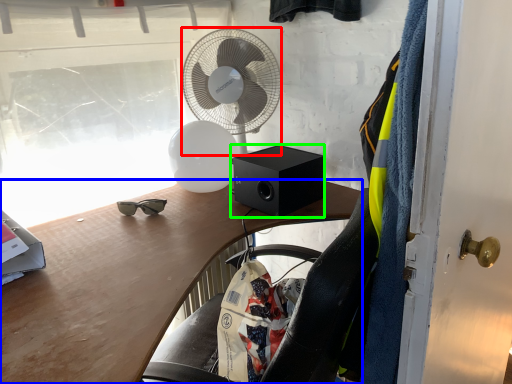
Question: Which object is the farthest from mechanical fan (highlighted by a red box)? Choose among these: desk (highlighted by a blue box) or loudspeaker (highlighted by a green box).

Choices:
 (A) desk
 (B) loudspeaker

Answer: (A)